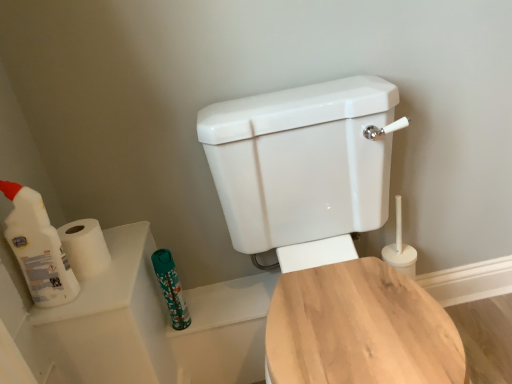
At what (x,y) coordinates should I click in order to perform the action: click on vacant area that is in front of white matte toilet paper at left. Please return your answer as a coordinate pair (x, y). Looking at the image, I should click on (98, 294).